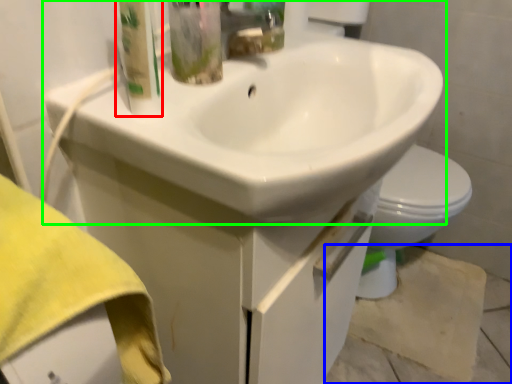
Question: Which object is the farthest from cleaning product (highlighted by a red box)? Choose among these: concrete (highlighted by a blue box) or sink (highlighted by a green box).

Choices:
 (A) concrete
 (B) sink

Answer: (A)